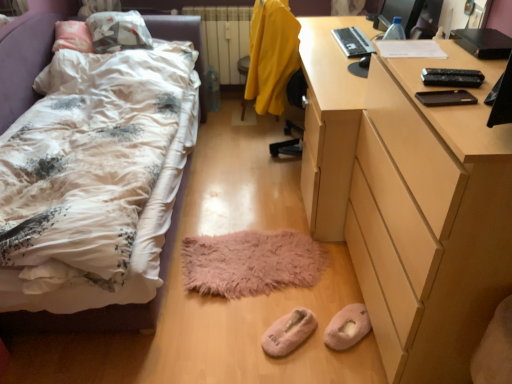
What do you see at coordinates (86, 319) in the screenshot?
I see `fluffy white bed at left` at bounding box center [86, 319].

In order to face black plastic laptop at upper right, should I rotate leftwards or rightwards?

Turn right by 12.973 degrees to look at black plastic laptop at upper right.

Locate an element on the screen. The image size is (512, 384). yellow fabric swivel chair at center is located at coordinates (272, 56).

Locate an element on the screen. The height and width of the screenshot is (384, 512). white painted metal radiator at center is located at coordinates (224, 38).

Identify the location of pink fluffy slippers at lower center, which is the second footwear in left-to-right order. coord(347,327).

Is yellow fabric swivel chair at center positioned beyond the bounds of pink fluffy slippers at lower center, acting as the 1th footwear starting from the right?

Yes.

Based on the photo, considering the positions of objects yellow fabric swivel chair at center and pink fluffy slippers at lower center, acting as the 1th footwear starting from the right, in the image provided, who is more to the left, yellow fabric swivel chair at center or pink fluffy slippers at lower center, acting as the 1th footwear starting from the right,?

yellow fabric swivel chair at center.

From a real-world perspective, between yellow fabric swivel chair at center and pink fluffy slippers at lower center, which is the second footwear in left-to-right order, who is vertically higher?

In real-world perspective, yellow fabric swivel chair at center is above.

From their relative heights in the image, would you say yellow fabric swivel chair at center is taller or shorter than pink fluffy slippers at lower center, acting as the 1th footwear starting from the right?

Clearly, yellow fabric swivel chair at center is taller compared to pink fluffy slippers at lower center, acting as the 1th footwear starting from the right.

Is white painted metal radiator at center facing away from pink fluffy slippers at lower center, the 1th footwear from the left?

white painted metal radiator at center does not have its back to pink fluffy slippers at lower center, the 1th footwear from the left.

Considering the points (221, 15) and (290, 314), which point is behind, point (221, 15) or point (290, 314)?

Positioned behind is point (221, 15).

From a real-world perspective, is white painted metal radiator at center located higher than pink fluffy slippers at lower center, the 1th footwear from the left?

Yes, from a real-world perspective, white painted metal radiator at center is above pink fluffy slippers at lower center, the 1th footwear from the left.

From the image's perspective, is white painted metal radiator at center located above or below pink fluffy slippers at lower center, arranged as the 2th footwear when viewed from the right?

white painted metal radiator at center is situated higher than pink fluffy slippers at lower center, arranged as the 2th footwear when viewed from the right, in the image.

Considering the sizes of objects pink fluffy slippers at lower center, arranged as the 2th footwear when viewed from the right, and yellow fabric swivel chair at center in the image provided, who is shorter, pink fluffy slippers at lower center, arranged as the 2th footwear when viewed from the right, or yellow fabric swivel chair at center?

Standing shorter between the two is pink fluffy slippers at lower center, arranged as the 2th footwear when viewed from the right.

Locate an element on the screen. Image resolution: width=512 pixels, height=384 pixels. the 1st footwear to the right of the yellow fabric swivel chair at center, counting from the anchor's position is located at coordinates (288, 332).

Is the depth of pink fluffy slippers at lower center, the 1th footwear from the left, greater than that of yellow fabric swivel chair at center?

No, pink fluffy slippers at lower center, the 1th footwear from the left, is closer to the viewer.

Would you say pink fluffy slippers at lower center, the 1th footwear from the left, contains yellow fabric swivel chair at center?

No, yellow fabric swivel chair at center is not inside pink fluffy slippers at lower center, the 1th footwear from the left.

From a real-world perspective, who is located lower, yellow fabric swivel chair at center or light brown wooden desk at right?

light brown wooden desk at right, from a real-world perspective.

Is yellow fabric swivel chair at center shorter than light brown wooden desk at right?

Indeed, yellow fabric swivel chair at center has a lesser height compared to light brown wooden desk at right.

Consider the image. Is yellow fabric swivel chair at center facing away from light brown wooden desk at right?

No, yellow fabric swivel chair at center is not facing the opposite direction of light brown wooden desk at right.

Is fuzzy pink mat at center at the back of pink fluffy slippers at lower center, which is the second footwear in left-to-right order?

pink fluffy slippers at lower center, which is the second footwear in left-to-right order, does not have its back to fuzzy pink mat at center.

Which object is positioned more to the left, pink fluffy slippers at lower center, which is the second footwear in left-to-right order, or fuzzy pink mat at center?

fuzzy pink mat at center is more to the left.

Based on the photo, would you say pink fluffy slippers at lower center, which is the second footwear in left-to-right order, contains fuzzy pink mat at center?

No, fuzzy pink mat at center is located outside of pink fluffy slippers at lower center, which is the second footwear in left-to-right order.

From a real-world perspective, is pink fluffy slippers at lower center, which is the second footwear in left-to-right order, over fuzzy pink mat at center?

Yes, from a real-world perspective, pink fluffy slippers at lower center, which is the second footwear in left-to-right order, is on top of fuzzy pink mat at center.

From a real-world perspective, is pink fluffy slippers at lower center, which is the second footwear in left-to-right order, below yellow fabric swivel chair at center?

Yes.

Is pink fluffy slippers at lower center, acting as the 1th footwear starting from the right, outside of yellow fabric swivel chair at center?

pink fluffy slippers at lower center, acting as the 1th footwear starting from the right, is positioned outside yellow fabric swivel chair at center.

Looking at this image, considering the relative sizes of pink fluffy slippers at lower center, acting as the 1th footwear starting from the right, and yellow fabric swivel chair at center in the image provided, is pink fluffy slippers at lower center, acting as the 1th footwear starting from the right, shorter than yellow fabric swivel chair at center?

Correct, pink fluffy slippers at lower center, acting as the 1th footwear starting from the right, is not as tall as yellow fabric swivel chair at center.

Is pink fluffy slippers at lower center, which is the second footwear in left-to-right order, wider than yellow fabric swivel chair at center?

No, pink fluffy slippers at lower center, which is the second footwear in left-to-right order, is not wider than yellow fabric swivel chair at center.

In the scene shown: Could you measure the distance between pink fluffy slippers at lower center, the 1th footwear from the left, and pink fluffy slippers at lower center, acting as the 1th footwear starting from the right?

pink fluffy slippers at lower center, the 1th footwear from the left, and pink fluffy slippers at lower center, acting as the 1th footwear starting from the right, are 5.66 inches apart.

Is pink fluffy slippers at lower center, the 1th footwear from the left, in front of or behind pink fluffy slippers at lower center, acting as the 1th footwear starting from the right, in the image?

Visually, pink fluffy slippers at lower center, the 1th footwear from the left, is located in front of pink fluffy slippers at lower center, acting as the 1th footwear starting from the right.

Looking at their sizes, would you say pink fluffy slippers at lower center, the 1th footwear from the left, is wider or thinner than pink fluffy slippers at lower center, acting as the 1th footwear starting from the right?

pink fluffy slippers at lower center, the 1th footwear from the left, is thinner than pink fluffy slippers at lower center, acting as the 1th footwear starting from the right.

Is pink fluffy slippers at lower center, which is the second footwear in left-to-right order, at the back of pink fluffy slippers at lower center, arranged as the 2th footwear when viewed from the right?

No, pink fluffy slippers at lower center, arranged as the 2th footwear when viewed from the right, is not facing the opposite direction of pink fluffy slippers at lower center, which is the second footwear in left-to-right order.

Image resolution: width=512 pixels, height=384 pixels. What are the coordinates of `swivel chair above the pink fluffy slippers at lower center, which is the second footwear in left-to-right order (from a real-world perspective)` in the screenshot? It's located at (272, 56).

From a real-world perspective, count 2nd footwears downward from the white painted metal radiator at center and point to it. Please provide its 2D coordinates.

[(288, 332)]

Estimate the real-world distances between objects in this image. Which object is further from black plastic laptop at upper right, light brown wooden desk at right or pink fluffy slippers at lower center, acting as the 1th footwear starting from the right?

The object further to black plastic laptop at upper right is pink fluffy slippers at lower center, acting as the 1th footwear starting from the right.

From the image, which object appears to be farther from light brown wooden desk at right, yellow fabric swivel chair at center or black plastic laptop at upper right?

black plastic laptop at upper right lies further to light brown wooden desk at right than the other object.

Which object lies nearer to the anchor point black plastic laptop at upper right, fluffy white bed at left or pink fluffy slippers at lower center, the 1th footwear from the left?

fluffy white bed at left is closer to black plastic laptop at upper right.

Looking at this image, considering their positions, is black plastic laptop at upper right positioned closer to fluffy white bed at left than yellow fabric swivel chair at center?

yellow fabric swivel chair at center is positioned closer to the anchor fluffy white bed at left.

Considering their positions, is light brown wooden desk at right positioned further to yellow fabric swivel chair at center than pink fluffy slippers at lower center, arranged as the 2th footwear when viewed from the right?

pink fluffy slippers at lower center, arranged as the 2th footwear when viewed from the right.

Based on their spatial positions, is pink fluffy slippers at lower center, which is the second footwear in left-to-right order, or fluffy white bed at left closer to black plastic laptop at upper right?

fluffy white bed at left is closer to black plastic laptop at upper right.

Looking at this image, estimate the real-world distances between objects in this image. Which object is closer to fuzzy pink mat at center, pink fluffy slippers at lower center, the 1th footwear from the left, or pink fluffy slippers at lower center, acting as the 1th footwear starting from the right?

The object closer to fuzzy pink mat at center is pink fluffy slippers at lower center, the 1th footwear from the left.

Which object lies further to the anchor point white painted metal radiator at center, light brown wooden desk at right or fuzzy pink mat at center?

Among the two, fuzzy pink mat at center is located further to white painted metal radiator at center.

You are a GUI agent. You are given a task and a screenshot of the screen. Output one action in this format:
    pyautogui.click(x=<x>, y=<y>)
    Task: Click on the footwear between white painted metal radiator at center and pink fluffy slippers at lower center, the 1th footwear from the left, vertically
    The width and height of the screenshot is (512, 384).
    Given the screenshot: What is the action you would take?
    pyautogui.click(x=347, y=327)

Where is `bed between light brown wooden desk at right and white painted metal radiator at center in the front-back direction`? bed between light brown wooden desk at right and white painted metal radiator at center in the front-back direction is located at coordinates (86, 319).

In order to click on bed between yellow fabric swivel chair at center and pink fluffy slippers at lower center, which is the second footwear in left-to-right order, in the vertical direction in this screenshot , I will do `click(86, 319)`.

You are a GUI agent. You are given a task and a screenshot of the screen. Output one action in this format:
    pyautogui.click(x=<x>, y=<y>)
    Task: Click on the swivel chair between black plastic laptop at upper right and pink fluffy slippers at lower center, acting as the 1th footwear starting from the right, from top to bottom
    Image resolution: width=512 pixels, height=384 pixels.
    Given the screenshot: What is the action you would take?
    pyautogui.click(x=272, y=56)